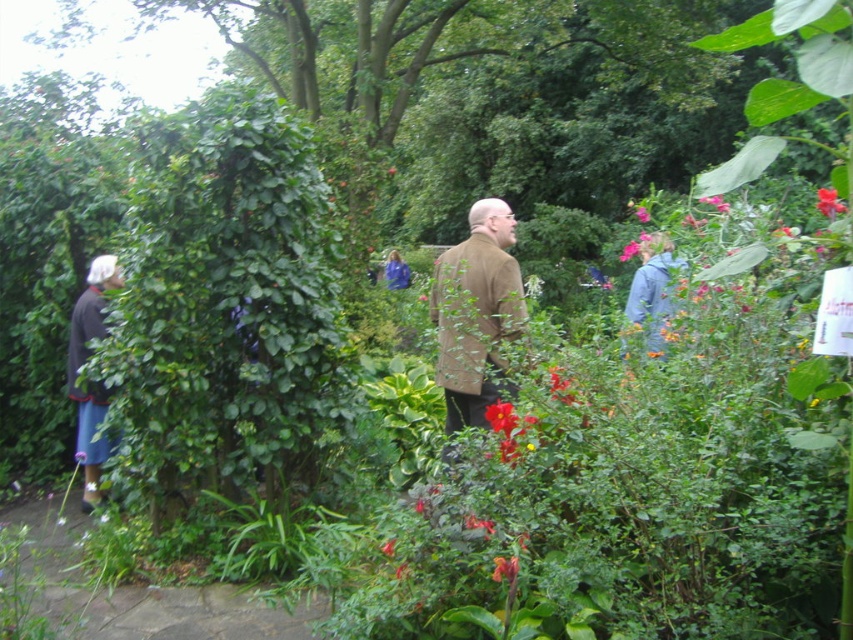
Between blue denim pants at left and pink matte flower at upper right, which one appears on the left side from the viewer's perspective?

blue denim pants at left

Is blue denim pants at left positioned at the back of pink matte flower at upper right?

Yes.

Measure the distance between point (84, 348) and camera.

The distance of point (84, 348) from camera is 5.39 meters.

I want to click on blue denim pants at left, so click(90, 381).

What do you see at coordinates (502, 417) in the screenshot?
I see `vivid red petals at center` at bounding box center [502, 417].

Who is lower down, vivid red petals at center or bright pink petals at center?

Positioned lower is vivid red petals at center.

Does point (502, 406) come closer to viewer compared to point (625, 253)?

Yes.

Find the location of a particular element. vivid red petals at center is located at coordinates (502, 417).

Between blue denim pants at left and vibrant orange flower at center, which one appears on the right side from the viewer's perspective?

vibrant orange flower at center is more to the right.

From the picture: Between blue denim pants at left and vibrant orange flower at center, which one is positioned higher?

Positioned higher is vibrant orange flower at center.

Image resolution: width=853 pixels, height=640 pixels. Describe the element at coordinates (90, 381) in the screenshot. I see `blue denim pants at left` at that location.

Identify the location of blue denim pants at left. click(90, 381).